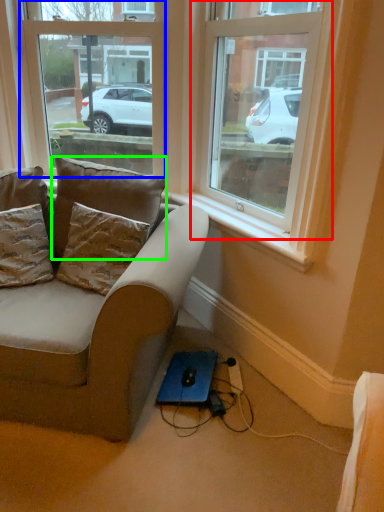
Question: Based on their relative distances, which object is nearer to window (highlighted by a red box)? Choose from window (highlighted by a blue box) and pillow (highlighted by a green box).

Choices:
 (A) window
 (B) pillow

Answer: (B)